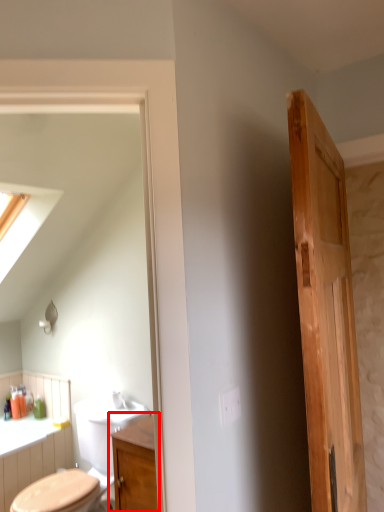
Question: Considering the relative positions of bathroom cabinet (annotated by the red box) and door in the image provided, where is bathroom cabinet (annotated by the red box) located with respect to the staircase?

Choices:
 (A) right
 (B) left

Answer: (B)